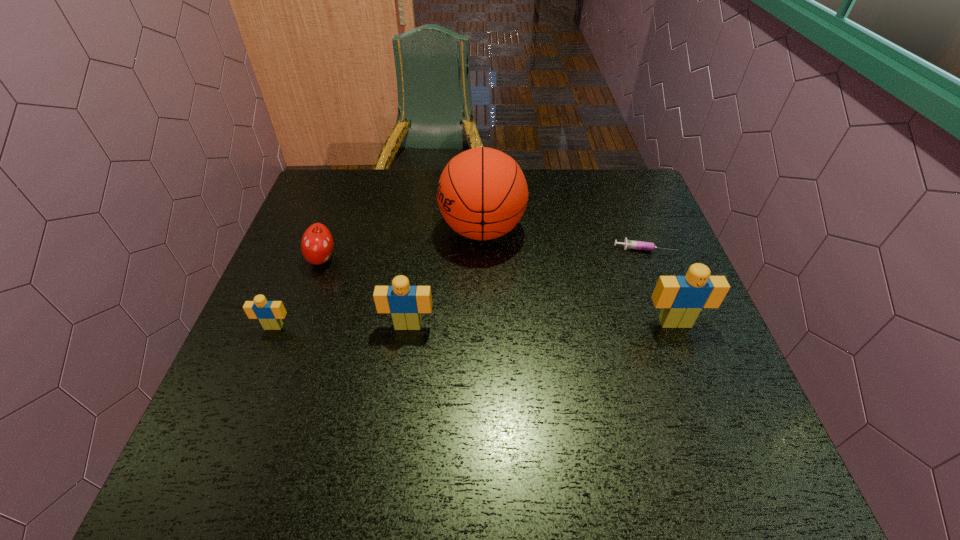
The image size is (960, 540). Identify the location of vacant region that satisfies the following two spatial constraints: 1. on the back side of the shortest object; 2. on the side with logo of the basketball. (637, 230).

You are a GUI agent. You are given a task and a screenshot of the screen. Output one action in this format:
    pyautogui.click(x=<x>, y=<y>)
    Task: Click on the blank space that satisfies the following two spatial constraints: 1. on the side with logo of the tallest object; 2. on the face of the shortest Lego
    The image size is (960, 540).
    Given the screenshot: What is the action you would take?
    pyautogui.click(x=483, y=327)